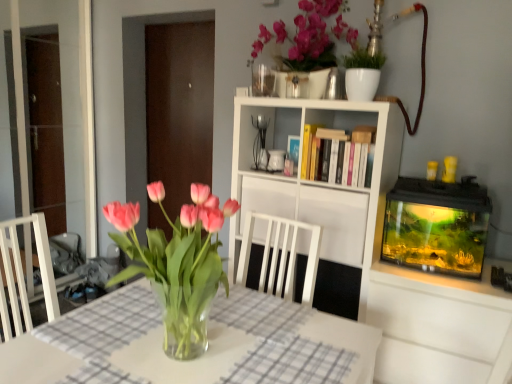
What do you see at coordinates (197, 358) in the screenshot?
I see `clear glass vase at center` at bounding box center [197, 358].

What do you see at coordinates (179, 107) in the screenshot? I see `transparent glass door at center, the 2th glass door from the left` at bounding box center [179, 107].

At what (x,y) coordinates should I click in order to perform the action: click on clear glass vase at center. Please return your answer as a coordinate pair (x, y). The width and height of the screenshot is (512, 384). Looking at the image, I should click on (197, 358).

How different are the orientations of white matte cabinet at center and transparent glass door at left, which is the 1th glass door from left to right, in degrees?

white matte cabinet at center and transparent glass door at left, which is the 1th glass door from left to right, are facing 92.2 degrees away from each other.

From a real-world perspective, is white matte cabinet at center under transparent glass door at left, which is the 1th glass door from left to right?

Yes, from a real-world perspective, white matte cabinet at center is under transparent glass door at left, which is the 1th glass door from left to right.

From the image's perspective, is white matte cabinet at center located above or below transparent glass door at left, which is the 1th glass door from left to right?

white matte cabinet at center is situated lower than transparent glass door at left, which is the 1th glass door from left to right, in the image.

Would you say white matte cabinet at center is to the left or to the right of transparent glass door at left, which is the 1th glass door from left to right, in the picture?

From the image, it's evident that white matte cabinet at center is to the right of transparent glass door at left, which is the 1th glass door from left to right.

Consider the image. Considering their positions, is pink glass vase at center located in front of or behind transparent glass door at left, which is the 1th glass door from left to right?

In the image, pink glass vase at center appears in front of transparent glass door at left, which is the 1th glass door from left to right.

How different are the orientations of pink glass vase at center and transparent glass door at left, which is the 1th glass door from left to right, in degrees?

89.5 degrees separate the facing orientations of pink glass vase at center and transparent glass door at left, which is the 1th glass door from left to right.

From a real-world perspective, who is located lower, pink glass vase at center or transparent glass door at left, the second glass door from the right?

In real-world perspective, pink glass vase at center is lower.

Can we say pink glass vase at center lies outside transparent glass door at left, which is the 1th glass door from left to right?

Indeed, pink glass vase at center is completely outside transparent glass door at left, which is the 1th glass door from left to right.

How many degrees apart are the facing directions of clear glass vase at center and pink glass vase at center?

The angle between the facing direction of clear glass vase at center and the facing direction of pink glass vase at center is 0.000112 degrees.

Considering the positions of points (292, 343) and (195, 297), is point (292, 343) closer to camera compared to point (195, 297)?

No, it is behind (195, 297).

Considering the relative positions of clear glass vase at center and pink glass vase at center in the image provided, is clear glass vase at center behind pink glass vase at center?

No, clear glass vase at center is closer to the viewer.

From a real-world perspective, which object stands above the other?

pink glass vase at center.

Is hardcover books at center facing towards transparent glass door at center, the 2th glass door from the left?

No, hardcover books at center is not oriented towards transparent glass door at center, the 2th glass door from the left.

Based on their positions, is hardcover books at center located to the left or right of transparent glass door at center, the 2th glass door from the left?

hardcover books at center is positioned on transparent glass door at center, the 2th glass door from the left,'s right side.

From a real-world perspective, is hardcover books at center positioned under transparent glass door at center, which is the 1th glass door in right-to-left order, based on gravity?

Incorrect, from a real-world perspective, hardcover books at center is higher than transparent glass door at center, which is the 1th glass door in right-to-left order.

Consider the image. Between hardcover books at center and transparent glass door at center, the 2th glass door from the left, which one has more height?

Standing taller between the two is transparent glass door at center, the 2th glass door from the left.

Is white matte cabinet at center to the left or to the right of pink glass vase at center in the image?

Clearly, white matte cabinet at center is on the right of pink glass vase at center in the image.

In order to click on cabinet that appears on the right of pink glass vase at center in this screenshot , I will do `click(336, 221)`.

Is point (348, 253) positioned in front of point (193, 338)?

No, it is behind (193, 338).

Is white matte cabinet at center thinner than pink glass vase at center?

No.

Is transparent glass door at center, the 2th glass door from the left, aimed at white matte bookshelf at center?

No, transparent glass door at center, the 2th glass door from the left, is not turned towards white matte bookshelf at center.

Considering the sizes of objects transparent glass door at center, which is the 1th glass door in right-to-left order, and white matte bookshelf at center in the image provided, who is wider, transparent glass door at center, which is the 1th glass door in right-to-left order, or white matte bookshelf at center?

With larger width is white matte bookshelf at center.

Is white matte bookshelf at center completely or partially inside transparent glass door at center, which is the 1th glass door in right-to-left order?

That's incorrect, white matte bookshelf at center is not inside transparent glass door at center, which is the 1th glass door in right-to-left order.

In the scene shown: Is transparent glass door at center, the 2th glass door from the left, positioned behind white matte bookshelf at center?

Yes, transparent glass door at center, the 2th glass door from the left, is behind white matte bookshelf at center.

Is transparent glass door at center, which is the 1th glass door in right-to-left order, positioned in front of transparent glass door at left, which is the 1th glass door from left to right?

No, it is not.

What are the coordinates of `glass door on the right side of transparent glass door at left, which is the 1th glass door from left to right` in the screenshot? It's located at (179, 107).

Is transparent glass door at center, which is the 1th glass door in right-to-left order, outside of transparent glass door at left, the second glass door from the right?

Yes, transparent glass door at center, which is the 1th glass door in right-to-left order, is outside of transparent glass door at left, the second glass door from the right.

Locate an element on the screen. cabinet located on the right of transparent glass door at left, the second glass door from the right is located at coordinates (336, 221).

The width and height of the screenshot is (512, 384). I want to click on houseplant below the transparent glass door at left, which is the 1th glass door from left to right (from a real-world perspective), so click(x=177, y=263).

Estimate the real-world distances between objects in this image. Which object is closer to white matte cabinet at center, transparent glass door at left, the second glass door from the right, or pink glass vase at center?

The object closer to white matte cabinet at center is pink glass vase at center.

Looking at the image, which one is located closer to transparent glass door at center, the 2th glass door from the left, hardcover books at center or white matte bookshelf at center?

Based on the image, white matte bookshelf at center appears to be nearer to transparent glass door at center, the 2th glass door from the left.

From the image, which object appears to be nearer to transparent glass door at left, which is the 1th glass door from left to right, white matte cabinet at center or pink glass vase at center?

white matte cabinet at center.

When comparing their distances from white matte bookshelf at center, does white matte cabinet at center or hardcover books at center seem further?

Among the two, hardcover books at center is located further to white matte bookshelf at center.

Which object lies nearer to the anchor point transparent glass door at left, which is the 1th glass door from left to right, white matte cabinet at center or white matte bookshelf at center?

white matte bookshelf at center is closer to transparent glass door at left, which is the 1th glass door from left to right.

Which object lies nearer to the anchor point white matte cabinet at center, clear glass vase at center or transparent glass door at left, which is the 1th glass door from left to right?

clear glass vase at center.

From the image, which object appears to be farther from hardcover books at center, transparent glass door at left, the second glass door from the right, or white matte bookshelf at center?

transparent glass door at left, the second glass door from the right, is positioned further to the anchor hardcover books at center.

Based on their spatial positions, is white matte bookshelf at center or transparent glass door at center, which is the 1th glass door in right-to-left order, further from transparent glass door at left, which is the 1th glass door from left to right?

white matte bookshelf at center lies further to transparent glass door at left, which is the 1th glass door from left to right, than the other object.

The width and height of the screenshot is (512, 384). I want to click on table located between transparent glass door at left, which is the 1th glass door from left to right, and white matte bookshelf at center in the left-right direction, so click(197, 358).

Where is `cabinetry located between transparent glass door at left, the second glass door from the right, and white matte cabinet at center in the left-right direction`? This screenshot has width=512, height=384. cabinetry located between transparent glass door at left, the second glass door from the right, and white matte cabinet at center in the left-right direction is located at coordinates (319, 191).

I want to click on book located between clear glass vase at center and transparent glass door at center, which is the 1th glass door in right-to-left order, in the depth direction, so click(338, 155).

Identify the location of cabinet positioned between clear glass vase at center and transparent glass door at center, which is the 1th glass door in right-to-left order, from near to far. The width and height of the screenshot is (512, 384). (336, 221).